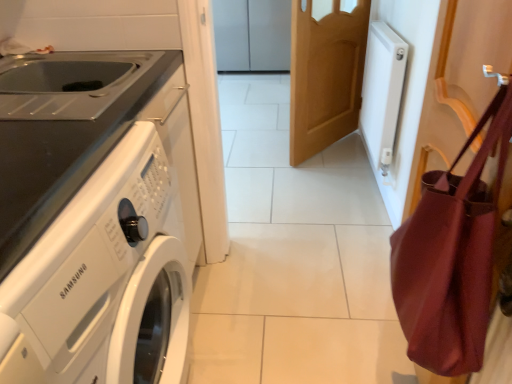
Question: From a real-world perspective, is metallic stainless steel sink at left positioned above or below white glossy cabinet at upper center?

Choices:
 (A) above
 (B) below

Answer: (A)

Question: Is metallic stainless steel sink at left to the left or to the right of white glossy cabinet at upper center in the image?

Choices:
 (A) left
 (B) right

Answer: (A)

Question: Which of these objects is positioned farthest from the light brown wooden door at center?

Choices:
 (A) white glossy washing machine at left
 (B) white glossy cabinet at upper center
 (C) metallic stainless steel sink at left
 (D) matte burgundy shoulder bag at right

Answer: (B)

Question: Considering the real-world distances, which object is farthest from the white glossy cabinet at upper center?

Choices:
 (A) matte burgundy shoulder bag at right
 (B) metallic stainless steel sink at left
 (C) white glossy washing machine at left
 (D) light brown wooden door at center

Answer: (A)